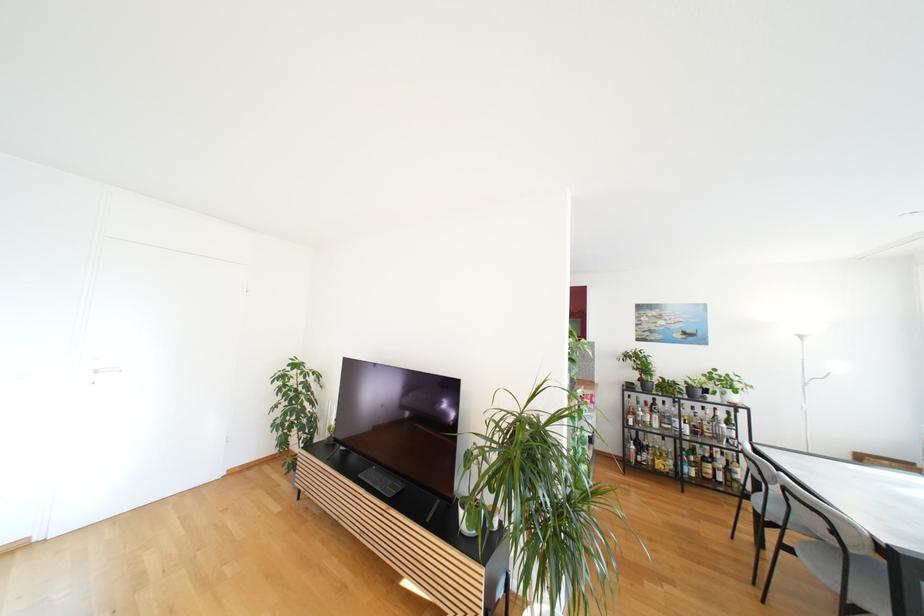
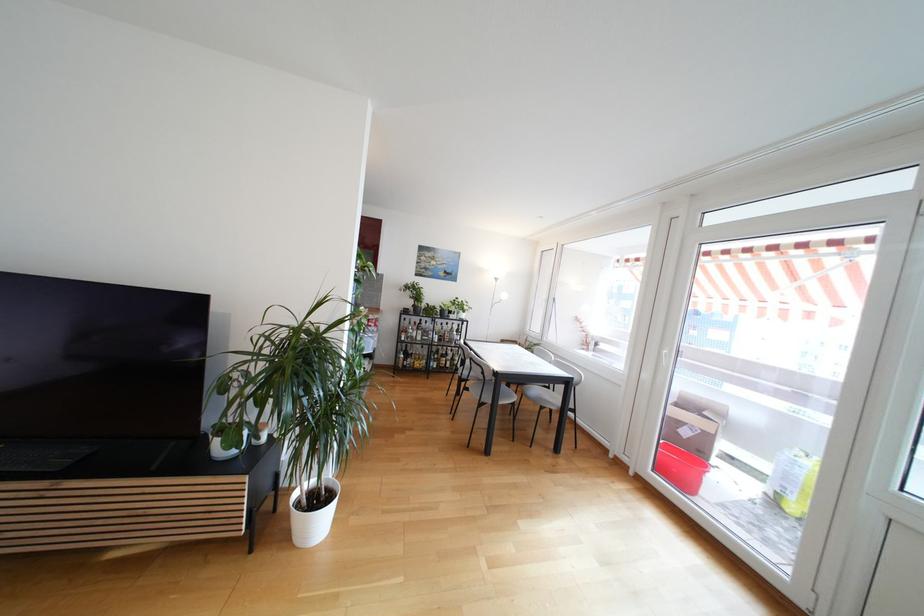
Question: I am providing you with two images of the same scene from different viewpoints. Please identify which objects are invisible in image2.

Choices:
 (A) small white pot
 (B) cardboard box
 (C) grey chair sitting surface
 (D) none of these

Answer: (D)